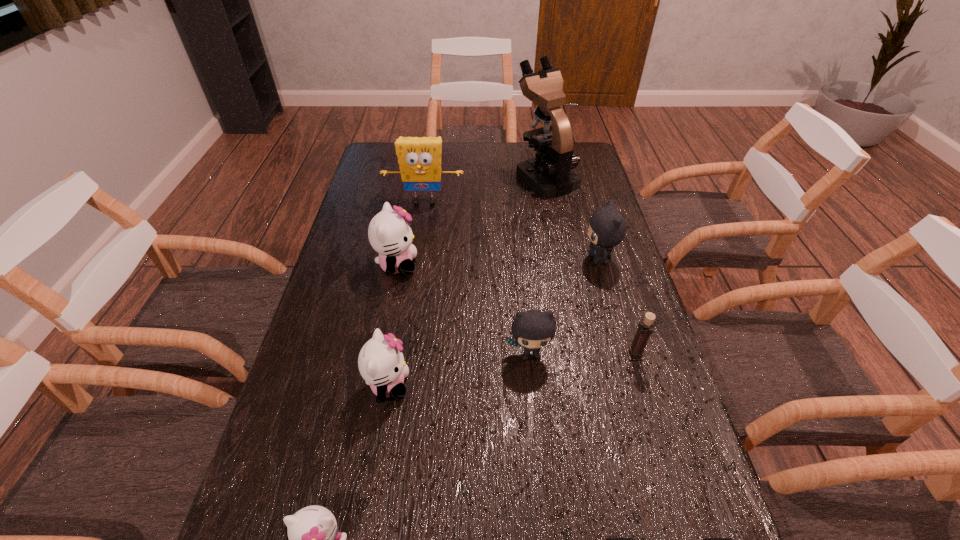
Find the location of a particular element. The image size is (960, 540). blank region between the bigger gray kitten and the left gray kitten is located at coordinates (564, 306).

The image size is (960, 540). What are the coordinates of `blank region between the rightmost kitten and the microscope` in the screenshot? It's located at (572, 218).

I want to click on free space between the second tallest object and the tallest object, so click(485, 189).

Identify the location of object that stands as the eighth closest to the rightmost kitten. The image size is (960, 540). (313, 539).

Choose which object is the eighth nearest neighbor to the smaller gray kitten. Please provide its 2D coordinates. Your answer should be formatted as a tuple, i.e. [(x, y)], where the tuple contains the x and y coordinates of a point satisfying the conditions above.

[(550, 174)]

Identify which kitten is the closest to the second biggest white kitten. Please provide its 2D coordinates. Your answer should be formatted as a tuple, i.e. [(x, y)], where the tuple contains the x and y coordinates of a point satisfying the conditions above.

[(533, 329)]

Where is `the second closest kitten to the farthest white kitten`? The width and height of the screenshot is (960, 540). the second closest kitten to the farthest white kitten is located at coordinates (533, 329).

Identify which white kitten is the second nearest to the shortest kitten. Please provide its 2D coordinates. Your answer should be formatted as a tuple, i.e. [(x, y)], where the tuple contains the x and y coordinates of a point satisfying the conditions above.

[(390, 235)]

Find the location of `white kitten that is the third closest to the bigger gray kitten`. white kitten that is the third closest to the bigger gray kitten is located at coordinates (313, 539).

This screenshot has width=960, height=540. In order to click on gray kitten that stands as the closest to the yellow sponge in this screenshot , I will do `click(607, 227)`.